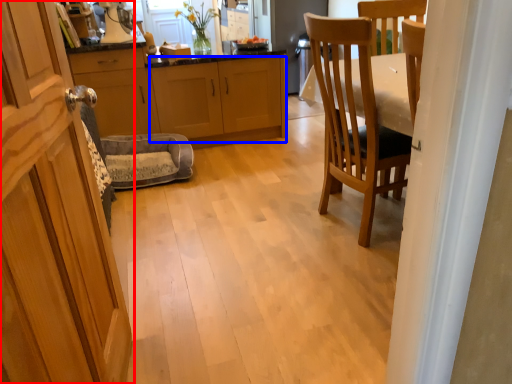
Question: Among these objects, which one is farthest to the camera, cabinetry (highlighted by a red box) or cabinetry (highlighted by a blue box)?

Choices:
 (A) cabinetry
 (B) cabinetry

Answer: (B)